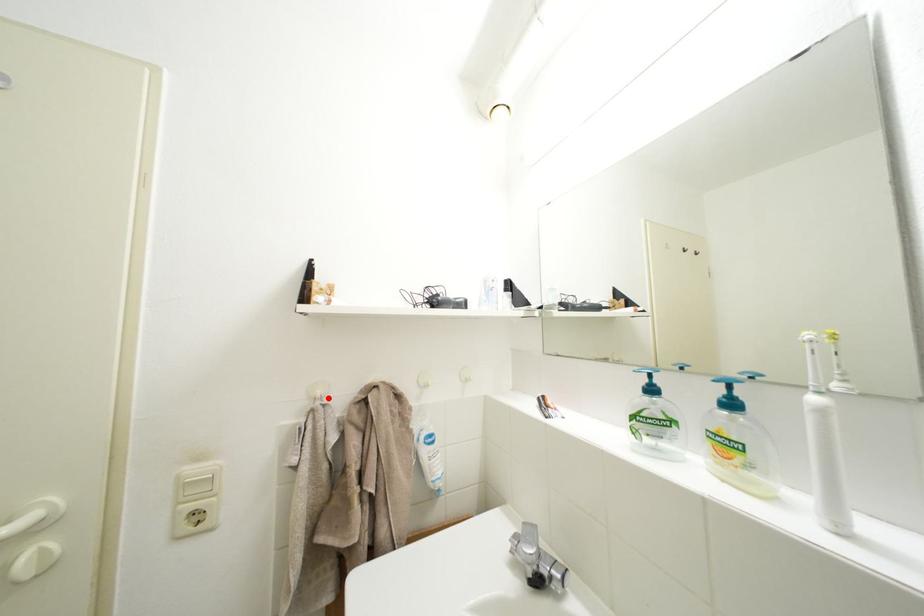
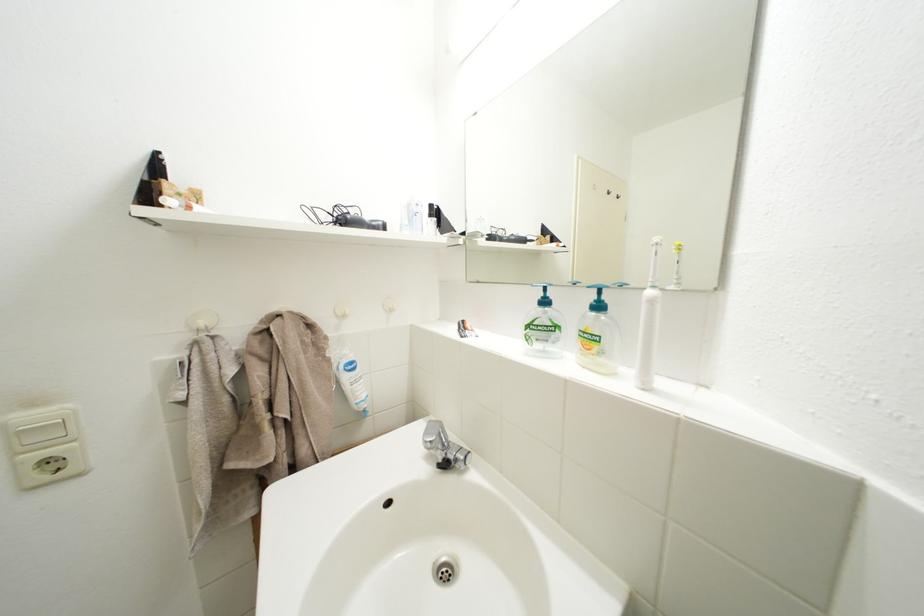
In the second image, find the point that corresponds to the highlighted location in the first image.

(211, 329)